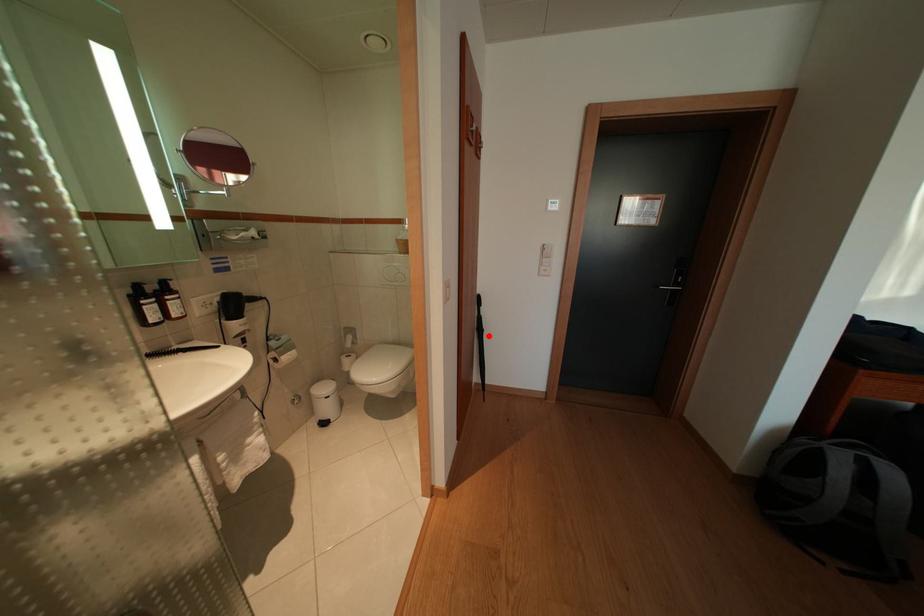
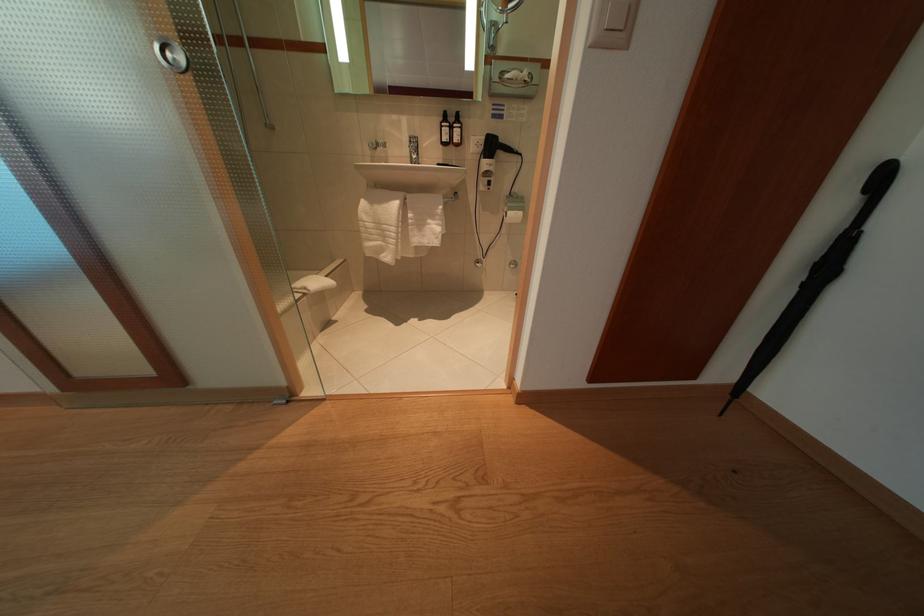
Where in the second image is the point corresponding to the highlighted location from the first image?

(834, 275)